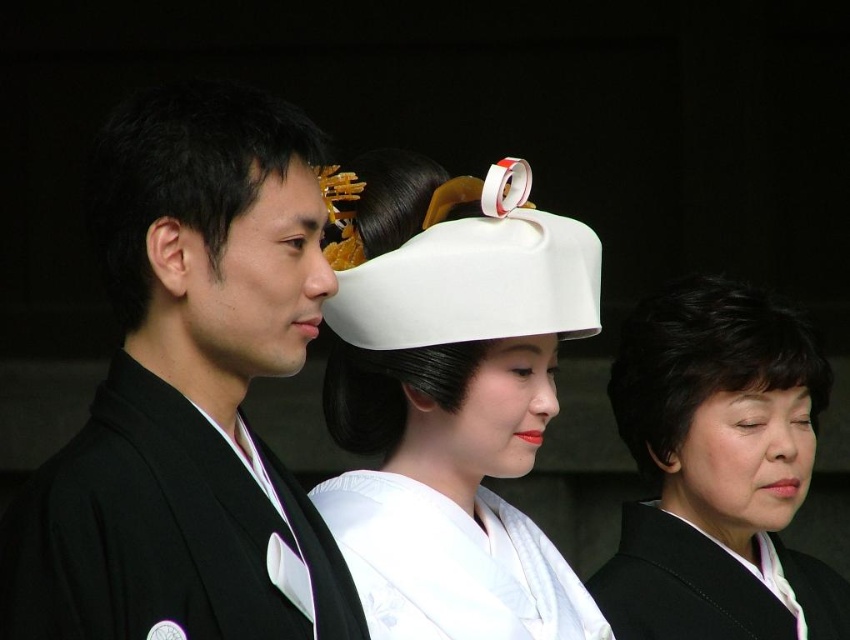
Question: Is black silk kimono at left wider than white matte hat at center?

Choices:
 (A) yes
 (B) no

Answer: (B)

Question: Is white matte headdress at center to the right of black matte kimono at right from the viewer's perspective?

Choices:
 (A) no
 (B) yes

Answer: (A)

Question: Which of the following is the closest to the observer?

Choices:
 (A) (722, 458)
 (B) (440, 278)
 (C) (89, 211)

Answer: (C)

Question: Which point is farther to the camera?

Choices:
 (A) black matte hair at left
 (B) white silk kimono at center
 (C) black matte kimono at right

Answer: (C)

Question: Can you confirm if black silk kimono at left is smaller than black matte hair at left?

Choices:
 (A) no
 (B) yes

Answer: (A)

Question: Which object is closer to the camera taking this photo?

Choices:
 (A) black matte hair at center
 (B) black matte hair at left
 (C) white matte headdress at center

Answer: (B)